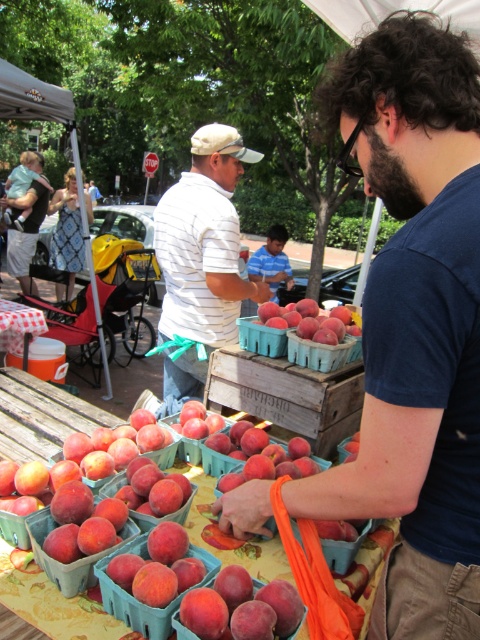
You are a customer at the market and want to choose between the plastic cup at lower left and the matte plastic basket at center to carry your peaches. Which container has a larger opening to easily place the peaches inside?

The plastic cup at lower left might be wider than matte plastic basket at center, so it has a larger opening for easier placement of peaches.

You are standing at the center of the market and see the point marked at coordinates (310,321). What object is located at that point?

The point at coordinates (310,321) corresponds to the peachy matte peaches at center.